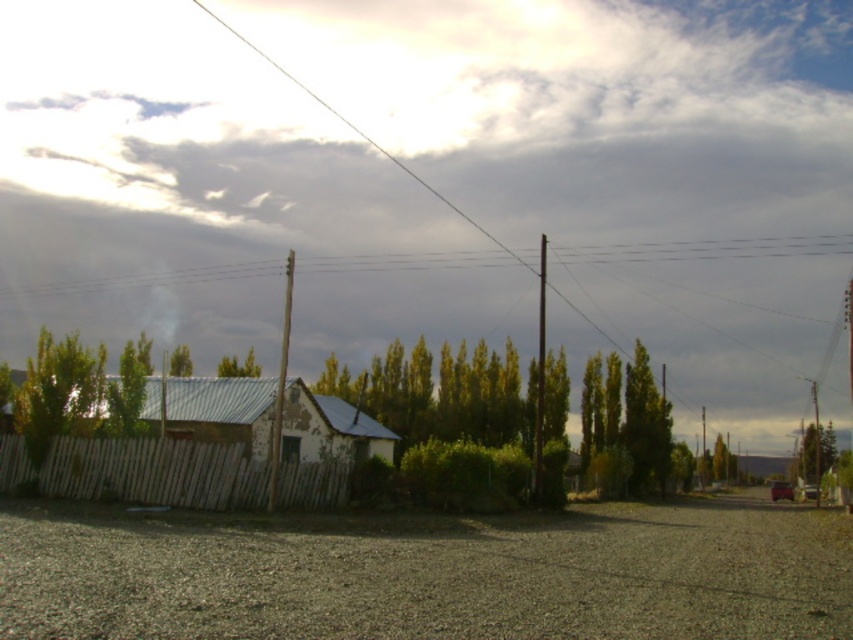
Consider the image. You are a hiker standing on the gravel road and want to take a photo of the white wooden fence at lower left and the smooth wooden pole at center. Which object should you focus on first to ensure both are in the frame?

You should focus on the white wooden fence at lower left first because it is closer to you than the smooth wooden pole at center, ensuring both are in the frame.

You are a delivery person trying to locate a delivery address. You see a rusty corrugated metal hut at center and a smooth wooden pole at center. According to the scene description, which object is positioned to the right of the other?

The rusty corrugated metal hut at center is positioned to the right of the smooth wooden pole at center.

You are a painter standing at the edge of the gravel road in the rural scene. You need to paint both the white wooden fence at lower left and the smooth wooden pole at center. Which object should you paint first if you want to start with the narrower one?

The white wooden fence at lower left is thinner than the smooth wooden pole at center, so you should paint the white wooden fence at lower left first.